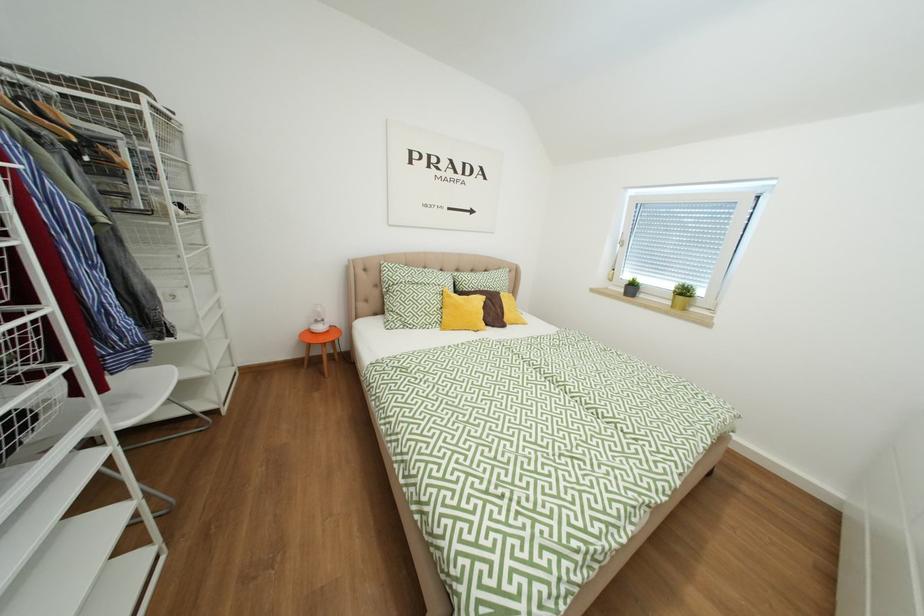
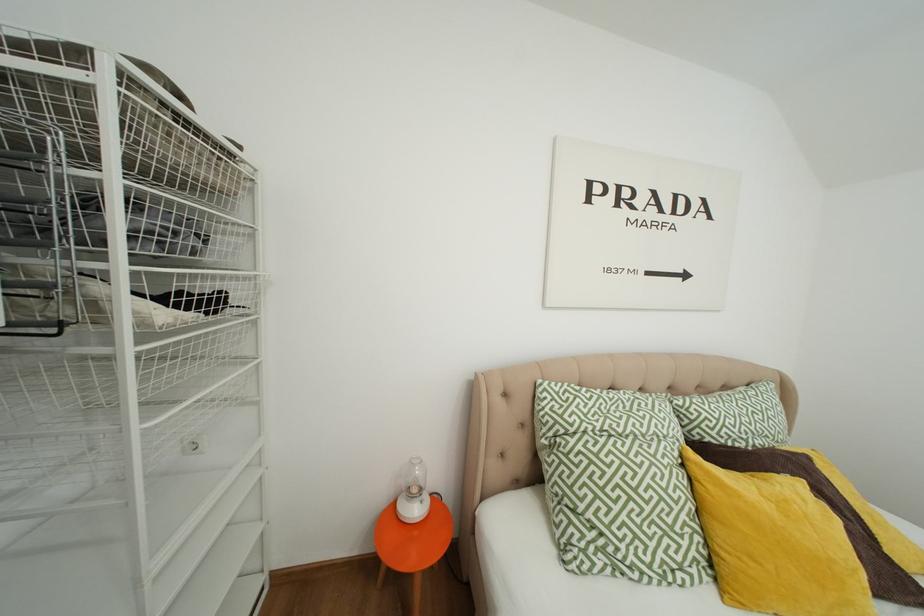
In a continuous first-person perspective shot, in which direction is the camera moving?

The cameraman walked toward left, forward.